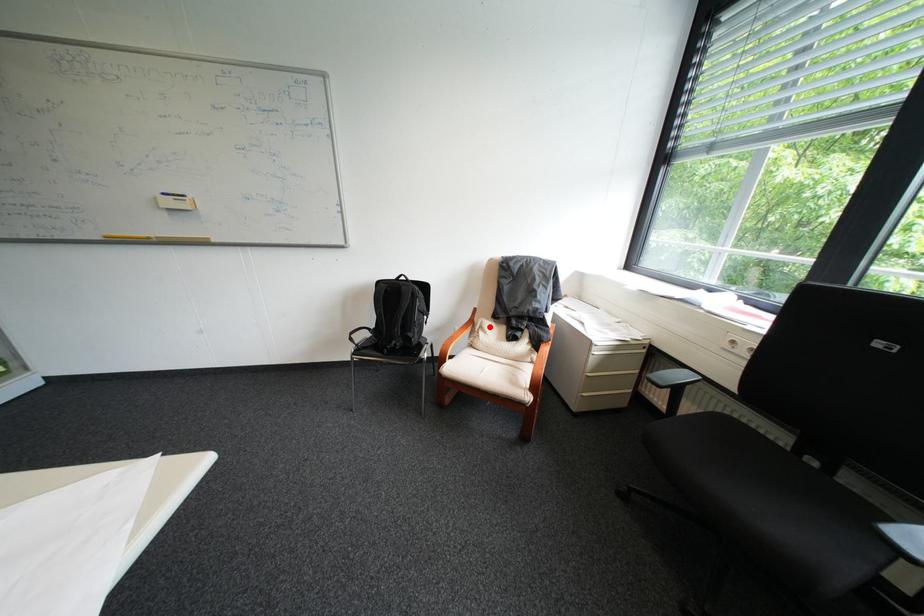
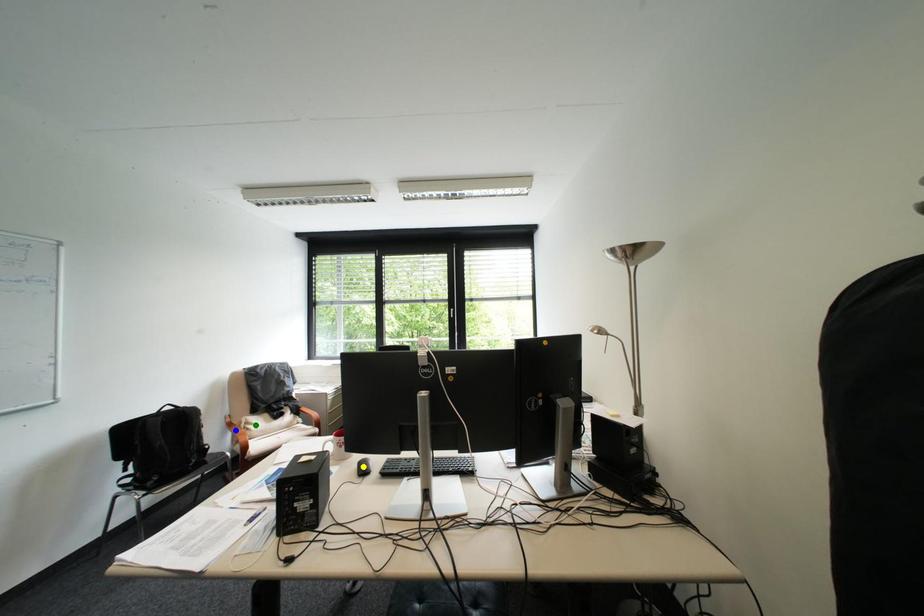
Question: I am providing you with two images of the same scene from different viewpoints. A red point is marked on the first image. You are given multiple points on the second image. Which mark in image 2 goes with the point in image 1?

Choices:
 (A) blue point
 (B) green point
 (C) yellow point

Answer: (B)